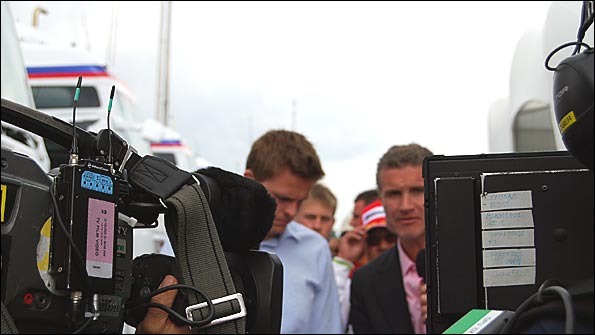
Find the location of a particular element. The width and height of the screenshot is (595, 335). monitor is located at coordinates (440, 239).